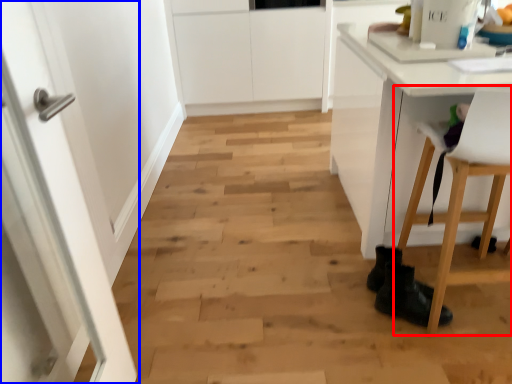
Question: Which point is further to the camera, chair (highlighted by a red box) or door (highlighted by a blue box)?

Choices:
 (A) chair
 (B) door

Answer: (A)